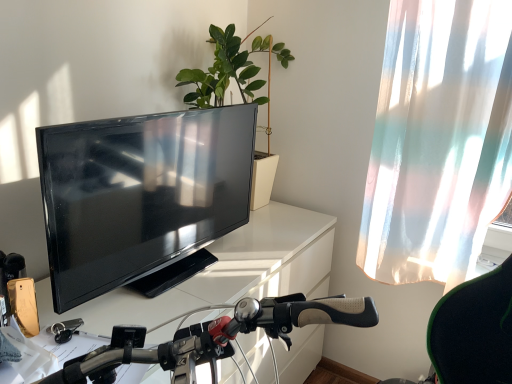
At what (x,y) coordinates should I click in order to perform the action: click on free spot in front of green matte plant at upper center. Please return your answer as a coordinate pair (x, y). Image resolution: width=512 pixels, height=384 pixels. Looking at the image, I should click on click(247, 250).